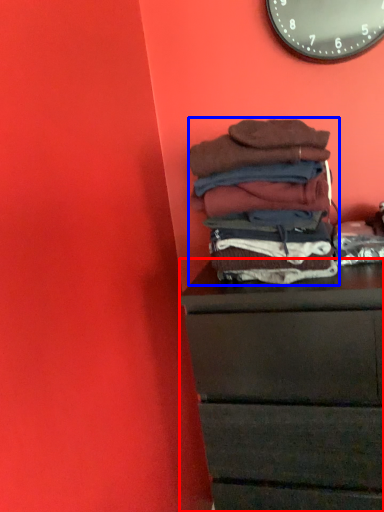
Question: Which point is closer to the camera, chest of drawers (highlighted by a red box) or material (highlighted by a blue box)?

Choices:
 (A) chest of drawers
 (B) material

Answer: (A)